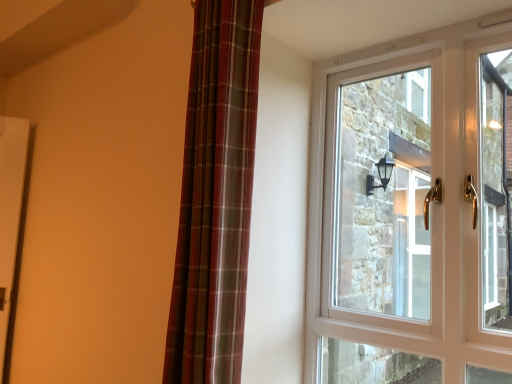
Question: From a real-world perspective, is white glossy door at upper right positioned above or below plaid fabric curtain at left?

Choices:
 (A) above
 (B) below

Answer: (B)

Question: Is point (433, 203) positioned closer to the camera than point (225, 314)?

Choices:
 (A) closer
 (B) farther

Answer: (B)

Question: Based on their sizes in the image, would you say white glossy door at upper right is bigger or smaller than plaid fabric curtain at left?

Choices:
 (A) small
 (B) big

Answer: (A)

Question: Based on their sizes in the image, would you say plaid fabric curtain at left is bigger or smaller than white glossy door at upper right?

Choices:
 (A) small
 (B) big

Answer: (B)

Question: Is plaid fabric curtain at left situated inside white glossy door at upper right or outside?

Choices:
 (A) inside
 (B) outside

Answer: (B)

Question: In the image, is plaid fabric curtain at left positioned in front of or behind white glossy door at upper right?

Choices:
 (A) front
 (B) behind

Answer: (A)

Question: Visually, is plaid fabric curtain at left positioned to the left or to the right of white glossy door at upper right?

Choices:
 (A) left
 (B) right

Answer: (A)